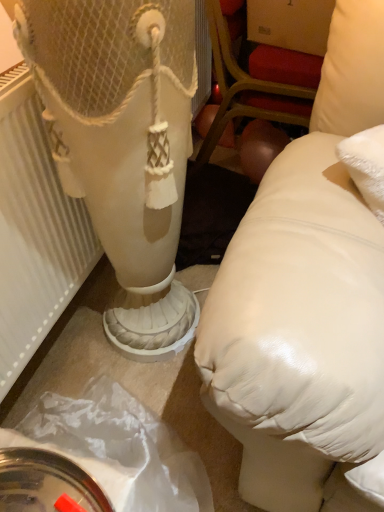
Find the location of a particular element. The width and height of the screenshot is (384, 512). white textured radiator at left is located at coordinates (34, 231).

The height and width of the screenshot is (512, 384). What do you see at coordinates (34, 231) in the screenshot?
I see `white textured radiator at left` at bounding box center [34, 231].

Measure the distance between white textured radiator at left and camera.

They are 29.98 inches apart.

Measure the distance between matte white pillow at right and camera.

A distance of 1.26 meters exists between matte white pillow at right and camera.

Identify the location of matte white pillow at right. This screenshot has height=512, width=384. (258, 82).

What is the approximate height of matte white pillow at right?

matte white pillow at right is 30.73 inches in height.

Describe the element at coordinates (258, 82) in the screenshot. I see `matte white pillow at right` at that location.

The height and width of the screenshot is (512, 384). I want to click on white textured radiator at left, so click(x=34, y=231).

Which is more to the right, matte white pillow at right or white textured radiator at left?

matte white pillow at right.

Is the depth of matte white pillow at right greater than that of white textured radiator at left?

Yes.

Which is less distant, (222, 54) or (95, 238)?

Point (222, 54).

From the image's perspective, is matte white pillow at right on white textured radiator at left?

Yes, from the image's perspective, matte white pillow at right is on top of white textured radiator at left.

From a real-world perspective, is matte white pillow at right located higher than white textured radiator at left?

No, from a real-world perspective, matte white pillow at right is not on top of white textured radiator at left.

Is matte white pillow at right wider than white textured radiator at left?

Correct, the width of matte white pillow at right exceeds that of white textured radiator at left.

Considering the sizes of objects matte white pillow at right and white textured radiator at left in the image provided, who is taller, matte white pillow at right or white textured radiator at left?

matte white pillow at right.

Considering the relative sizes of matte white pillow at right and white textured radiator at left in the image provided, is matte white pillow at right smaller than white textured radiator at left?

Actually, matte white pillow at right might be larger than white textured radiator at left.

Is matte white pillow at right completely or partially outside of white textured radiator at left?

Absolutely, matte white pillow at right is external to white textured radiator at left.

Is matte white pillow at right far away from white textured radiator at left?

Actually, matte white pillow at right and white textured radiator at left are a little close together.

Is matte white pillow at right aimed at white textured radiator at left?

No, matte white pillow at right is not oriented towards white textured radiator at left.

Can you tell me how much matte white pillow at right and white textured radiator at left differ in facing direction?

They differ by 0.537 degrees in their facing directions.

What are the coordinates of `radiator on the left of matte white pillow at right` in the screenshot? It's located at (34, 231).

Which is more to the left, white textured radiator at left or matte white pillow at right?

Positioned to the left is white textured radiator at left.

Between white textured radiator at left and matte white pillow at right, which one is positioned in front?

white textured radiator at left is more forward.

Is point (29, 78) farther from viewer compared to point (214, 12)?

No, it is in front of (214, 12).

From the image's perspective, relative to matte white pillow at right, is white textured radiator at left above or below?

white textured radiator at left is below matte white pillow at right.

From a real-world perspective, who is located higher, white textured radiator at left or matte white pillow at right?

In real-world perspective, white textured radiator at left is above.

Which object is thinner, white textured radiator at left or matte white pillow at right?

Thinner between the two is white textured radiator at left.

Is white textured radiator at left shorter than matte white pillow at right?

Correct, white textured radiator at left is not as tall as matte white pillow at right.

From the picture: Considering the relative sizes of white textured radiator at left and matte white pillow at right in the image provided, is white textured radiator at left smaller than matte white pillow at right?

Yes, white textured radiator at left is smaller than matte white pillow at right.

Can we say white textured radiator at left lies outside matte white pillow at right?

Yes, white textured radiator at left is located beyond the bounds of matte white pillow at right.

Is white textured radiator at left next to matte white pillow at right and touching it?

No, white textured radiator at left is not in contact with matte white pillow at right.

Is white textured radiator at left oriented towards matte white pillow at right?

No, white textured radiator at left is not oriented towards matte white pillow at right.

How distant is white textured radiator at left from matte white pillow at right?

white textured radiator at left and matte white pillow at right are 32.28 inches apart from each other.

At what (x,y) coordinates should I click in order to perform the action: click on furniture behind the white textured radiator at left. Please return your answer as a coordinate pair (x, y). The width and height of the screenshot is (384, 512). Looking at the image, I should click on (258, 82).

I want to click on radiator on the left of the matte white pillow at right, so click(x=34, y=231).

At what (x,y) coordinates should I click in order to perform the action: click on furniture located above the white textured radiator at left (from the image's perspective). Please return your answer as a coordinate pair (x, y). Looking at the image, I should click on (258, 82).